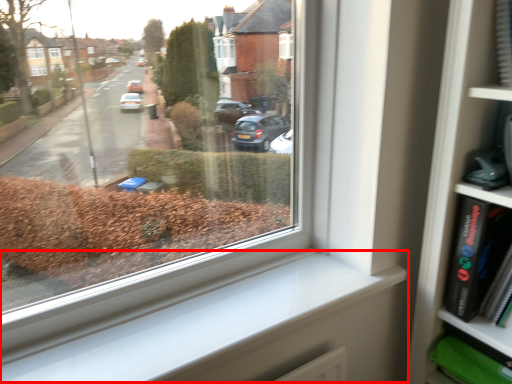
Question: From the image's perspective, where is window sill (annotated by the red box) located relative to paperback book?

Choices:
 (A) above
 (B) below

Answer: (B)